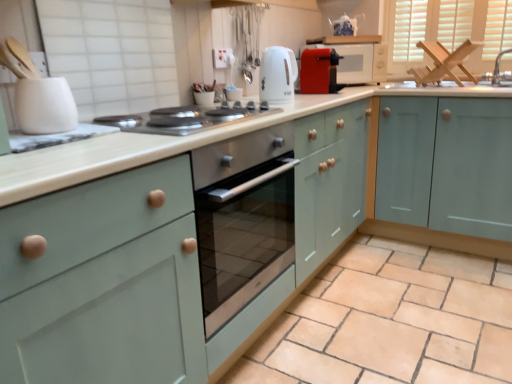
Question: Can you confirm if stainless steel cooktop at center is wider than silver metallic faucet at upper right?

Choices:
 (A) no
 (B) yes

Answer: (B)

Question: Is the position of stainless steel cooktop at center more distant than that of silver metallic faucet at upper right?

Choices:
 (A) yes
 (B) no

Answer: (B)

Question: From a real-world perspective, is stainless steel cooktop at center positioned over silver metallic faucet at upper right based on gravity?

Choices:
 (A) no
 (B) yes

Answer: (A)

Question: Is stainless steel cooktop at center at the right side of silver metallic faucet at upper right?

Choices:
 (A) yes
 (B) no

Answer: (B)

Question: Is stainless steel cooktop at center taller than silver metallic faucet at upper right?

Choices:
 (A) yes
 (B) no

Answer: (B)

Question: Is silver metallic faucet at upper right at the back of stainless steel cooktop at center?

Choices:
 (A) yes
 (B) no

Answer: (B)

Question: Is blue and white porcelain tea pot at upper center oriented towards silver metallic faucet at upper right?

Choices:
 (A) yes
 (B) no

Answer: (B)

Question: Is blue and white porcelain tea pot at upper center smaller than silver metallic faucet at upper right?

Choices:
 (A) yes
 (B) no

Answer: (A)

Question: From a real-world perspective, is blue and white porcelain tea pot at upper center below silver metallic faucet at upper right?

Choices:
 (A) no
 (B) yes

Answer: (A)

Question: Is blue and white porcelain tea pot at upper center far away from silver metallic faucet at upper right?

Choices:
 (A) no
 (B) yes

Answer: (A)

Question: Is the position of blue and white porcelain tea pot at upper center less distant than that of silver metallic faucet at upper right?

Choices:
 (A) yes
 (B) no

Answer: (B)

Question: Is blue and white porcelain tea pot at upper center not within silver metallic faucet at upper right?

Choices:
 (A) no
 (B) yes

Answer: (B)

Question: Can you confirm if matte red microwave at upper right is wider than blue and white porcelain tea pot at upper center?

Choices:
 (A) no
 (B) yes

Answer: (B)